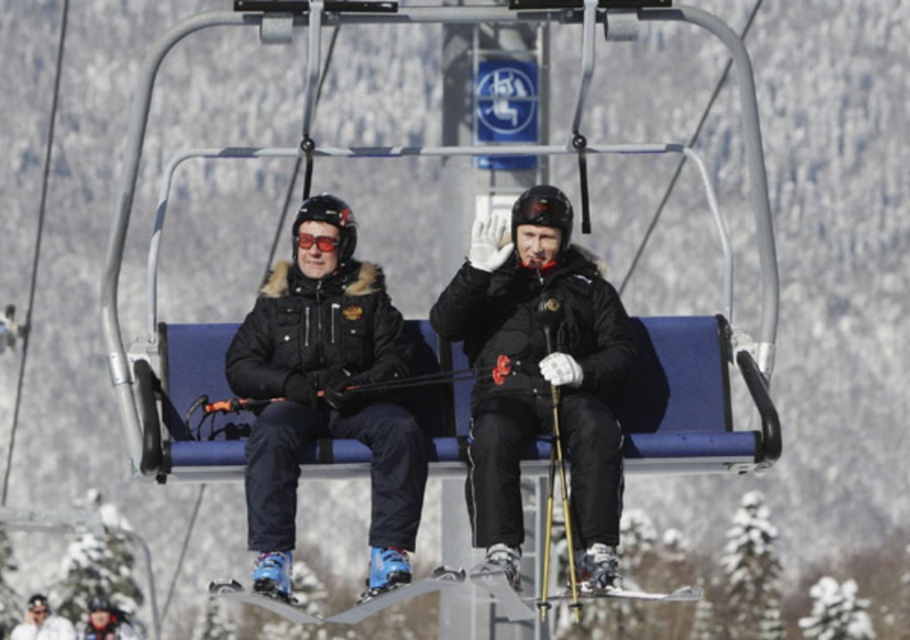
Can you confirm if matte black ski lift at center is wider than red reflective goggles at center?

Correct, the width of matte black ski lift at center exceeds that of red reflective goggles at center.

Does matte black ski lift at center have a greater height compared to red reflective goggles at center?

Indeed, matte black ski lift at center has a greater height compared to red reflective goggles at center.

Does point (140, 115) come in front of point (295, 252)?

Yes.

This screenshot has width=910, height=640. In order to click on matte black ski lift at center in this screenshot , I will do (455, 157).

Between point (571, 211) and point (655, 360), which one is positioned in front?

Point (655, 360) is more forward.

Who is lower down, matte black jackets at center or matte black ski lift at center?

matte black jackets at center is lower down.

Find the location of `matte black jackets at center`. matte black jackets at center is located at coordinates (539, 376).

This screenshot has width=910, height=640. I want to click on matte black jackets at center, so (539, 376).

Which is behind, point (476, 416) or point (334, 236)?

Positioned behind is point (334, 236).

Is matte black jackets at center positioned in front of red reflective goggles at center?

Yes, it is.

Is point (559, 289) more distant than point (312, 241)?

No, (559, 289) is in front of (312, 241).

Image resolution: width=910 pixels, height=640 pixels. I want to click on matte black jackets at center, so click(539, 376).